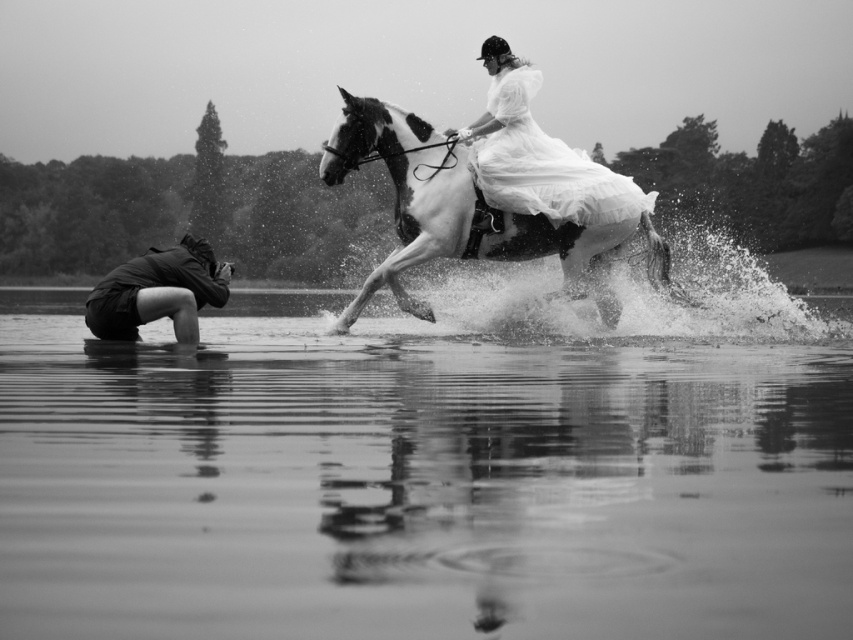
Can you confirm if white satin dress at upper center is shorter than dark gray fabric camera at lower left?

No.

What do you see at coordinates (543, 163) in the screenshot?
I see `white satin dress at upper center` at bounding box center [543, 163].

This screenshot has height=640, width=853. What are the coordinates of `white satin dress at upper center` in the screenshot? It's located at (543, 163).

Can you confirm if white glossy horse at center is smaller than white satin dress at upper center?

Actually, white glossy horse at center might be larger than white satin dress at upper center.

Who is lower down, white glossy horse at center or white satin dress at upper center?

Positioned lower is white glossy horse at center.

Find the location of `white glossy horse at center`. white glossy horse at center is located at coordinates (463, 212).

Between smooth water at lower center and white satin dress at upper center, which one is positioned lower?

smooth water at lower center is below.

Is smooth water at lower center bigger than white satin dress at upper center?

Indeed, smooth water at lower center has a larger size compared to white satin dress at upper center.

Between point (848, 456) and point (611, 221), which one is positioned behind?

The point (611, 221) is more distant.

You are a GUI agent. You are given a task and a screenshot of the screen. Output one action in this format:
    pyautogui.click(x=<x>, y=<y>)
    Task: Click on the smooth water at lower center
    The height and width of the screenshot is (640, 853).
    Given the screenshot: What is the action you would take?
    pyautogui.click(x=421, y=486)